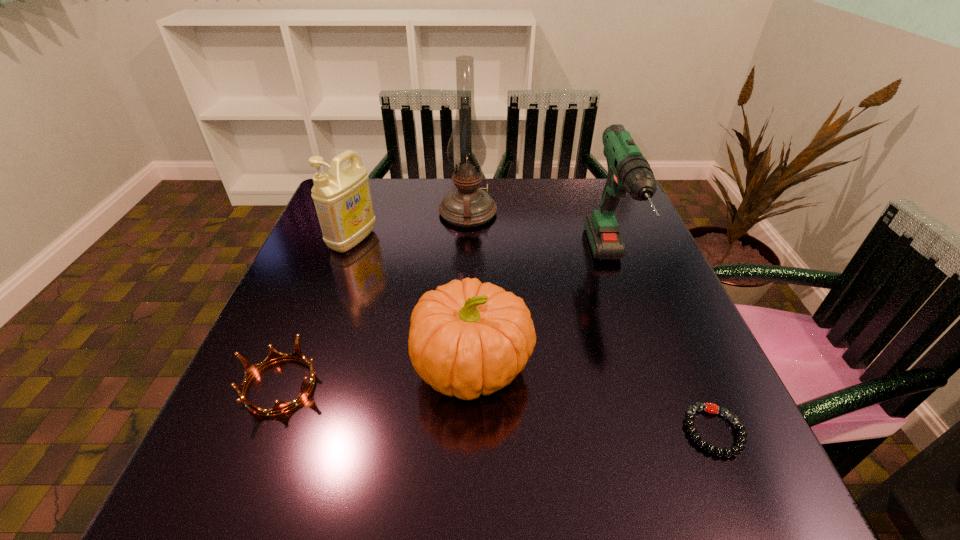
Image resolution: width=960 pixels, height=540 pixels. What are the coordinates of `free space between the detergent and the pumpkin` in the screenshot? It's located at (413, 303).

Locate an element on the screen. The image size is (960, 540). free space between the shortest object and the fourth tallest object is located at coordinates (593, 399).

Identify the location of vacant area between the pumpkin and the drill. Image resolution: width=960 pixels, height=540 pixels. (541, 316).

This screenshot has height=540, width=960. I want to click on vacant point located between the fourth shortest object and the oil lamp, so click(410, 226).

Point out which object is positioned as the fourth nearest to the pumpkin. Please provide its 2D coordinates. Your answer should be formatted as a tuple, i.e. [(x, y)], where the tuple contains the x and y coordinates of a point satisfying the conditions above.

[(342, 198)]

Select which object is the closest to the fifth tallest object. Please provide its 2D coordinates. Your answer should be formatted as a tuple, i.e. [(x, y)], where the tuple contains the x and y coordinates of a point satisfying the conditions above.

[(466, 338)]

What are the coordinates of `vacant position in the image that satisfies the following two spatial constraints: 1. on the handle side of the fifth shortest object; 2. on the surface of the third shortest object` in the screenshot? It's located at (644, 366).